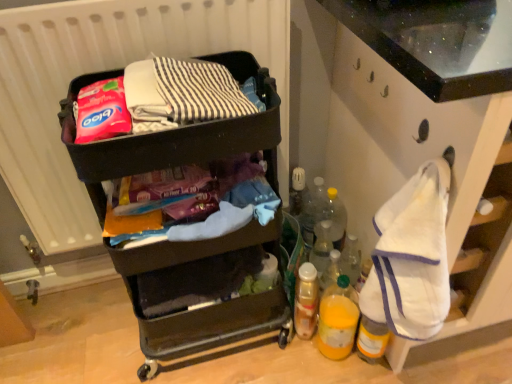
In order to click on free space in front of translucent plastic spray can at lower center, which is counted as the 3th bottle, starting from the top in this screenshot , I will do `click(300, 361)`.